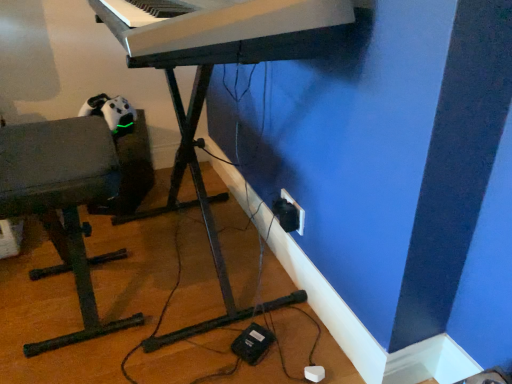
Question: In terms of size, does matte gray bench at left appear bigger or smaller than black plastic electric outlet at lower right?

Choices:
 (A) small
 (B) big

Answer: (B)

Question: Looking at their shapes, would you say matte gray bench at left is wider or thinner than black plastic electric outlet at lower right?

Choices:
 (A) thin
 (B) wide

Answer: (B)

Question: Estimate the real-world distances between objects in this image. Which object is closer to the black plastic electric outlet at lower right?

Choices:
 (A) matte gray bench at left
 (B) white plastic piano at center
 (C) black plastic plug at lower right
 (D) white plastic keyboard at upper center

Answer: (C)

Question: Which object is positioned farthest from the black plastic plug at lower right?

Choices:
 (A) white plastic keyboard at upper center
 (B) black plastic electric outlet at lower right
 (C) white plastic piano at center
 (D) matte gray bench at left

Answer: (A)